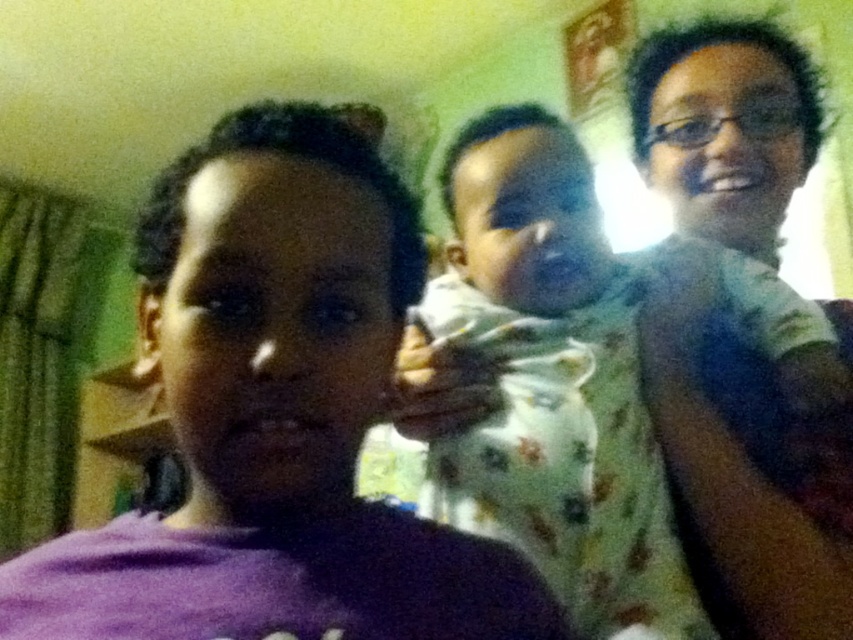
Question: Is purple matte shirt at center to the right of light green fabric baby at center from the viewer's perspective?

Choices:
 (A) no
 (B) yes

Answer: (A)

Question: Does purple matte shirt at center appear on the right side of light green fabric baby at center?

Choices:
 (A) no
 (B) yes

Answer: (A)

Question: Estimate the real-world distances between objects in this image. Which object is farther from the light green fabric baby at center?

Choices:
 (A) purple matte shirt at center
 (B) matte green shirt at upper right

Answer: (A)

Question: Which is farther from the purple matte shirt at center?

Choices:
 (A) light green fabric baby at center
 (B) matte green shirt at upper right

Answer: (B)

Question: Estimate the real-world distances between objects in this image. Which object is closer to the purple matte shirt at center?

Choices:
 (A) light green fabric baby at center
 (B) matte green shirt at upper right

Answer: (A)

Question: Is light green fabric baby at center bigger than matte green shirt at upper right?

Choices:
 (A) yes
 (B) no

Answer: (B)